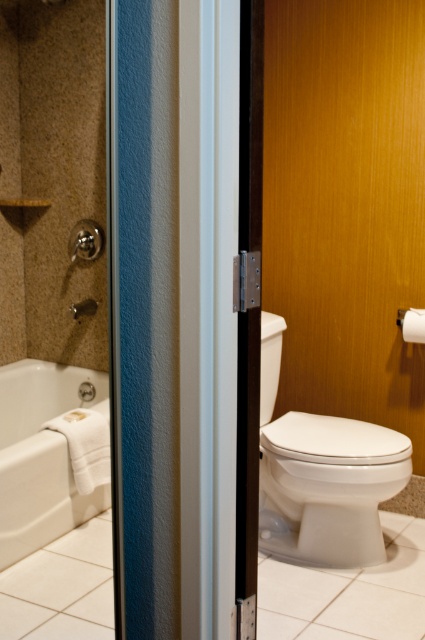
You are a bathroom designer planning to install a new shelf between the white glossy toilet at right and the white matte toilet paper at right. The shelf requires a minimum of 24 inches of space. Based on the current layout, is there enough space for the shelf?

The white glossy toilet at right is 25.73 inches away from the white matte toilet paper at right. Since the required space for the shelf is 24 inches, there is sufficient space between them to install the shelf.

You are a bathroom designer planning to place a new decorative item between the white glossy toilet at right and the white matte toilet paper at right. Which object should you place the item closer to if you want it to be near the larger object?

You should place the decorative item closer to the white glossy toilet at right because it is larger than the white matte toilet paper at right.

You are a plumber trying to access the pipes under the white glossy bathtub at lower left. You are currently standing in front of the white glossy toilet at right. Can you directly reach the pipes under the bathtub without moving the toilet?

The white glossy toilet at right is positioned over the white glossy bathtub at lower left, meaning the toilet is placed above the bathtub. Since the toilet is above the bathtub, you cannot directly reach the pipes under the bathtub without moving the toilet.